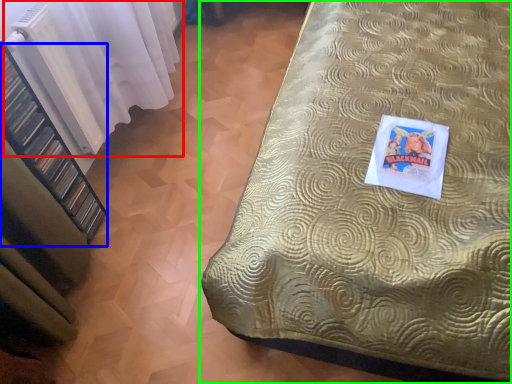
Question: Estimate the real-world distances between objects in this image. Which object is farther from curtain (highlighted by a red box), shelf (highlighted by a blue box) or bed (highlighted by a green box)?

Choices:
 (A) shelf
 (B) bed

Answer: (B)